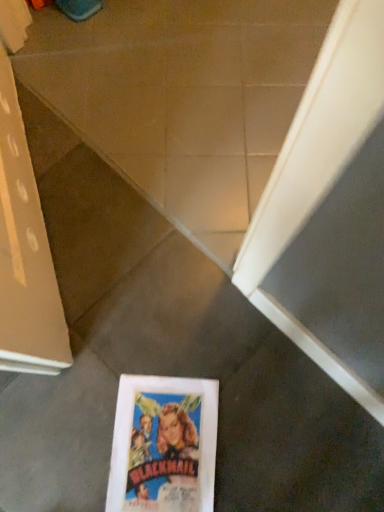
This screenshot has width=384, height=512. Find the location of `vacant area on top of multicolored paper at center (from a real-world perspective)`. vacant area on top of multicolored paper at center (from a real-world perspective) is located at coordinates (157, 449).